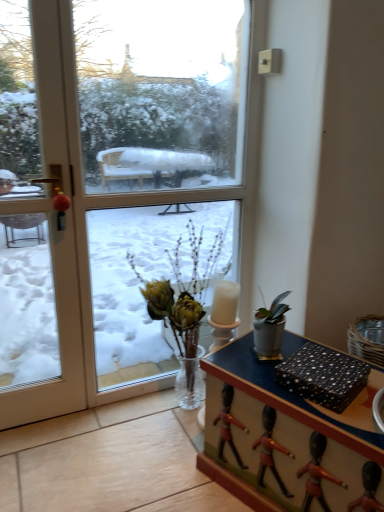
Question: Is transparent glass window at center in contact with black dotted paper at lower right?

Choices:
 (A) no
 (B) yes

Answer: (A)

Question: Is black dotted paper at lower right inside transparent glass window at center?

Choices:
 (A) yes
 (B) no

Answer: (B)

Question: From the image's perspective, is transparent glass window at center located beneath black dotted paper at lower right?

Choices:
 (A) no
 (B) yes

Answer: (A)

Question: Does transparent glass window at center have a lesser width compared to black dotted paper at lower right?

Choices:
 (A) yes
 (B) no

Answer: (A)

Question: Considering the relative sizes of transparent glass window at center and black dotted paper at lower right in the image provided, is transparent glass window at center bigger than black dotted paper at lower right?

Choices:
 (A) yes
 (B) no

Answer: (A)

Question: Is point (206, 394) closer or farther from the camera than point (13, 406)?

Choices:
 (A) closer
 (B) farther

Answer: (A)

Question: Looking at their shapes, would you say wooden desk at center is wider or thinner than white glossy door at left?

Choices:
 (A) thin
 (B) wide

Answer: (B)

Question: From their relative heights in the image, would you say wooden desk at center is taller or shorter than white glossy door at left?

Choices:
 (A) tall
 (B) short

Answer: (B)

Question: Considering the relative positions of wooden desk at center and white glossy door at left in the image provided, is wooden desk at center to the left or to the right of white glossy door at left?

Choices:
 (A) left
 (B) right

Answer: (B)

Question: Relative to transparent glass window at center, is black dotted paper at lower right in front or behind?

Choices:
 (A) behind
 (B) front

Answer: (B)

Question: Considering the relative positions of black dotted paper at lower right and transparent glass window at center in the image provided, is black dotted paper at lower right to the left or to the right of transparent glass window at center?

Choices:
 (A) right
 (B) left

Answer: (A)

Question: Is black dotted paper at lower right inside or outside of transparent glass window at center?

Choices:
 (A) outside
 (B) inside

Answer: (A)

Question: Looking at the image, does black dotted paper at lower right seem bigger or smaller compared to transparent glass window at center?

Choices:
 (A) big
 (B) small

Answer: (B)

Question: In terms of width, does transparent glass window at center look wider or thinner when compared to translucent glass vase at center?

Choices:
 (A) thin
 (B) wide

Answer: (A)

Question: Considering the positions of transparent glass window at center and translucent glass vase at center in the image, is transparent glass window at center taller or shorter than translucent glass vase at center?

Choices:
 (A) short
 (B) tall

Answer: (B)